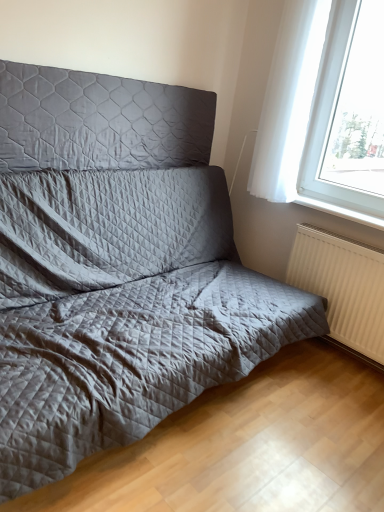
Identify the location of free spot to the left of white textured radiator at lower right. The height and width of the screenshot is (512, 384). (295, 356).